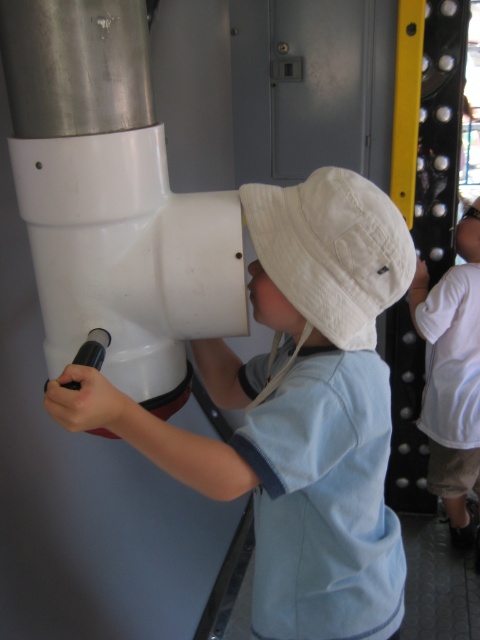
You are a safety inspector checking the equipment area. You notice two white cotton hats in the scene. The first is the white cotton baseball hat at center, and the second is the white cotton hat at upper center. According to safety regulations, all hats must be at least 4 feet apart to prevent obstruction. Can the current placement of these hats comply with the safety standards?

The distance between the white cotton baseball hat at center and the white cotton hat at upper center is 3.84 feet, which is less than the required 4 feet. Therefore, the current placement does not comply with the safety standards.